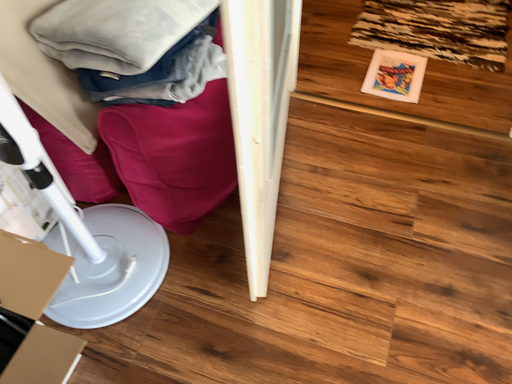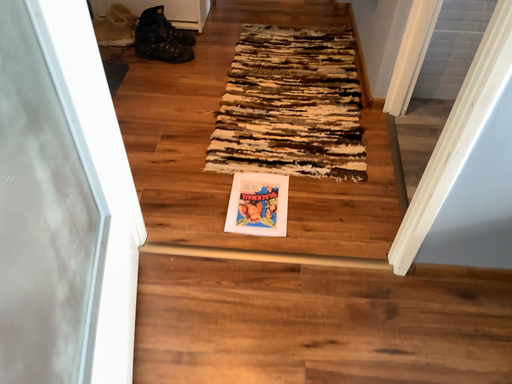
Question: How did the camera likely rotate when shooting the video?

Choices:
 (A) rotated left
 (B) rotated right

Answer: (B)